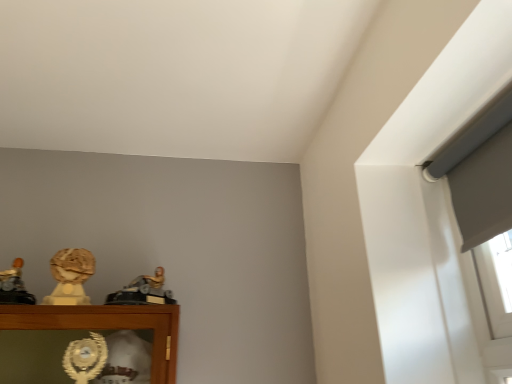
Question: Which direction should I rotate to look at gold metallic figure at center, arranged as the 3th character sculpture when viewed from the left?

Choices:
 (A) left
 (B) right

Answer: (A)

Question: Is matte gold statue at left, the 1th character sculpture viewed from the left, wider than gold metallic figure at center, arranged as the 3th character sculpture when viewed from the left?

Choices:
 (A) yes
 (B) no

Answer: (B)

Question: From the image's perspective, is matte gold statue at left, the 1th character sculpture viewed from the left, below gold metallic figure at center, which appears as the first character sculpture when viewed from the right?

Choices:
 (A) no
 (B) yes

Answer: (A)

Question: Considering the relative sizes of matte gold statue at left, the 3th character sculpture from the right, and gold metallic figure at center, which appears as the first character sculpture when viewed from the right, in the image provided, is matte gold statue at left, the 3th character sculpture from the right, bigger than gold metallic figure at center, which appears as the first character sculpture when viewed from the right,?

Choices:
 (A) yes
 (B) no

Answer: (B)

Question: From a real-world perspective, is matte gold statue at left, the 3th character sculpture from the right, over gold metallic figure at center, which appears as the first character sculpture when viewed from the right?

Choices:
 (A) yes
 (B) no

Answer: (B)

Question: Is matte gold statue at left, the 3th character sculpture from the right, further to camera compared to gold metallic figure at center, arranged as the 3th character sculpture when viewed from the left?

Choices:
 (A) no
 (B) yes

Answer: (A)

Question: Does matte gold statue at left, the 1th character sculpture viewed from the left, appear on the left side of gold metallic figure at center, which appears as the first character sculpture when viewed from the right?

Choices:
 (A) no
 (B) yes

Answer: (B)

Question: Is matte gold bust at left, the second character sculpture positioned from the right, positioned with its back to gold metallic figure at center, which appears as the first character sculpture when viewed from the right?

Choices:
 (A) no
 (B) yes

Answer: (A)

Question: Considering the relative sizes of matte gold bust at left, which appears as the 2th character sculpture when viewed from the left, and gold metallic figure at center, which appears as the first character sculpture when viewed from the right, in the image provided, is matte gold bust at left, which appears as the 2th character sculpture when viewed from the left, smaller than gold metallic figure at center, which appears as the first character sculpture when viewed from the right,?

Choices:
 (A) no
 (B) yes

Answer: (B)

Question: Is matte gold bust at left, which appears as the 2th character sculpture when viewed from the left, further to the viewer compared to gold metallic figure at center, which appears as the first character sculpture when viewed from the right?

Choices:
 (A) no
 (B) yes

Answer: (B)

Question: Is matte gold bust at left, the second character sculpture positioned from the right, aimed at gold metallic figure at center, arranged as the 3th character sculpture when viewed from the left?

Choices:
 (A) yes
 (B) no

Answer: (B)

Question: Is matte gold bust at left, which appears as the 2th character sculpture when viewed from the left, located outside gold metallic figure at center, which appears as the first character sculpture when viewed from the right?

Choices:
 (A) yes
 (B) no

Answer: (A)

Question: From the image's perspective, is matte gold bust at left, the second character sculpture positioned from the right, located beneath gold metallic figure at center, arranged as the 3th character sculpture when viewed from the left?

Choices:
 (A) yes
 (B) no

Answer: (B)

Question: Is gold metallic figure at center, which appears as the first character sculpture when viewed from the right, thinner than matte gold bust at left, the second character sculpture positioned from the right?

Choices:
 (A) yes
 (B) no

Answer: (B)